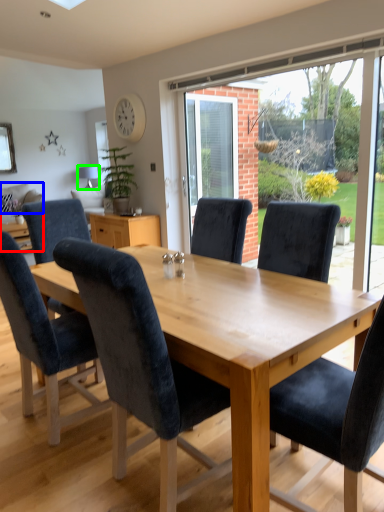
Question: Which is nearer to the studio couch (highlighted by a red box)? pillow (highlighted by a blue box) or lamp (highlighted by a green box).

Choices:
 (A) pillow
 (B) lamp

Answer: (A)